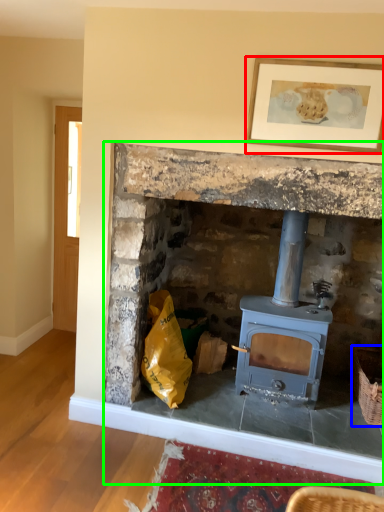
Question: Which is farther away from picture frame (highlighted by a red box)? basket (highlighted by a blue box) or fireplace (highlighted by a green box)?

Choices:
 (A) basket
 (B) fireplace

Answer: (A)